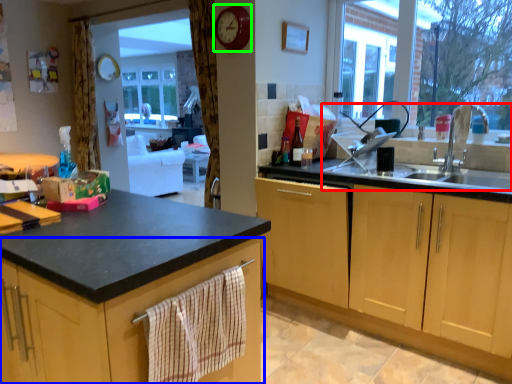
Question: Based on their relative distances, which object is nearer to sink (highlighted by a red box)? Choose from cabinetry (highlighted by a blue box) and clock (highlighted by a green box).

Choices:
 (A) cabinetry
 (B) clock

Answer: (B)